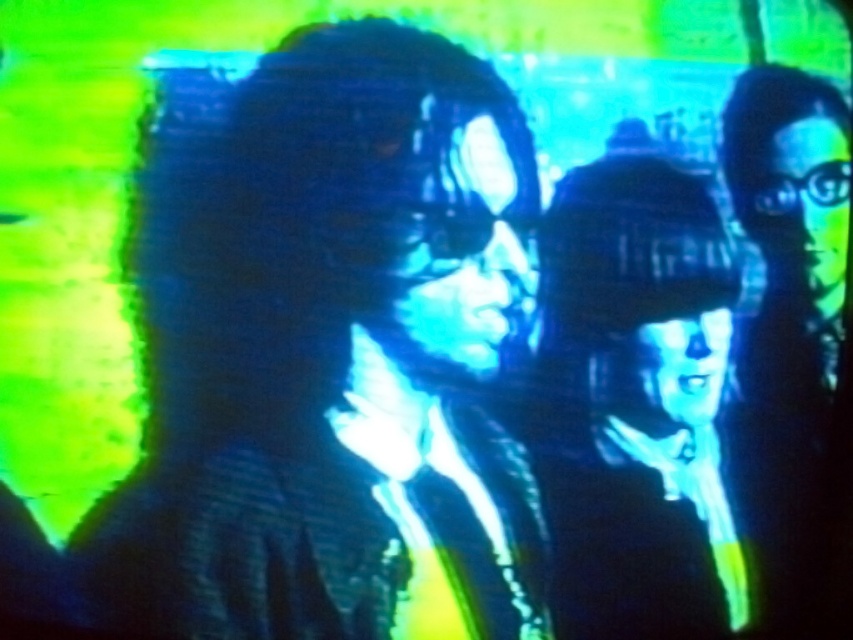
Question: Which object is farther from the camera taking this photo?

Choices:
 (A) matte black vr headset at center
 (B) matte black glasses at right

Answer: (A)

Question: Which point is farther to the camera?

Choices:
 (A) (630, 563)
 (B) (786, 360)

Answer: (A)

Question: Is matte black vr headset at center to the right of matte black glasses at right from the viewer's perspective?

Choices:
 (A) no
 (B) yes

Answer: (A)

Question: Can you confirm if matte black vr headset at center is smaller than matte black glasses at right?

Choices:
 (A) no
 (B) yes

Answer: (A)

Question: Which point is farther from the camera taking this photo?

Choices:
 (A) (639, 362)
 (B) (840, 96)

Answer: (A)

Question: Is the position of matte black vr headset at center less distant than that of matte black glasses at right?

Choices:
 (A) no
 (B) yes

Answer: (A)